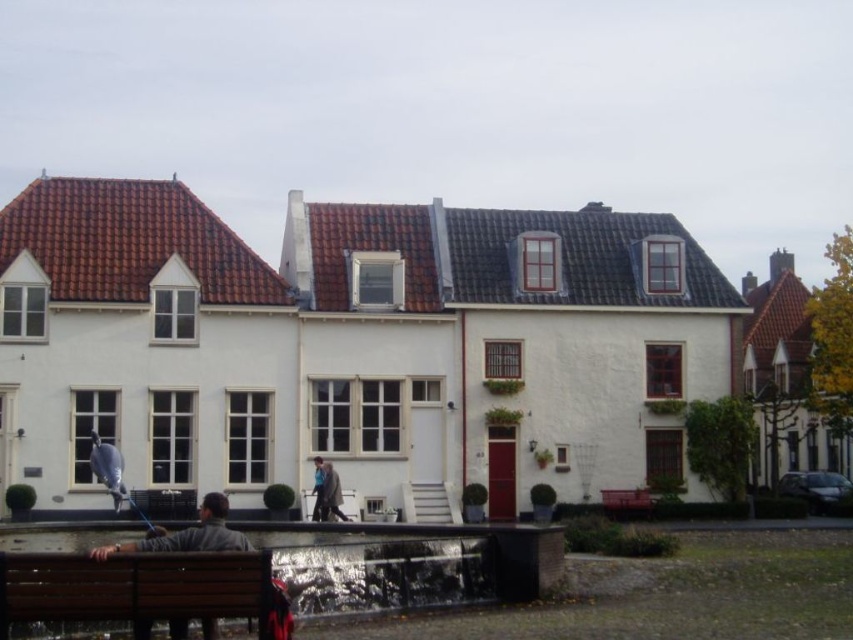
Does red wooden bench at lower right have a larger size compared to blue fabric jacket at center?

Yes, red wooden bench at lower right is bigger than blue fabric jacket at center.

Is red wooden bench at lower right taller than blue fabric jacket at center?

In fact, red wooden bench at lower right may be shorter than blue fabric jacket at center.

Is point (614, 513) in front of point (340, 497)?

No, (614, 513) is behind (340, 497).

This screenshot has width=853, height=640. I want to click on red wooden bench at lower right, so click(627, 502).

Who is positioned more to the right, blue fabric jacket at center or blue denim jacket at center?

blue fabric jacket at center

Does point (323, 497) come behind point (318, 472)?

No, it is in front of (318, 472).

Image resolution: width=853 pixels, height=640 pixels. Find the location of `blue fabric jacket at center`. blue fabric jacket at center is located at coordinates (329, 493).

Locate an element on the screen. The width and height of the screenshot is (853, 640). blue fabric jacket at center is located at coordinates (329, 493).

Does brown wooden bench at lower left have a lesser width compared to wooden bench at lower left?

Yes, brown wooden bench at lower left is thinner than wooden bench at lower left.

Who is positioned more to the left, brown wooden bench at lower left or wooden bench at lower left?

wooden bench at lower left

Between point (97, 577) and point (125, 545), which one is positioned in front?

Point (97, 577) is more forward.

The width and height of the screenshot is (853, 640). I want to click on brown wooden bench at lower left, so click(x=132, y=586).